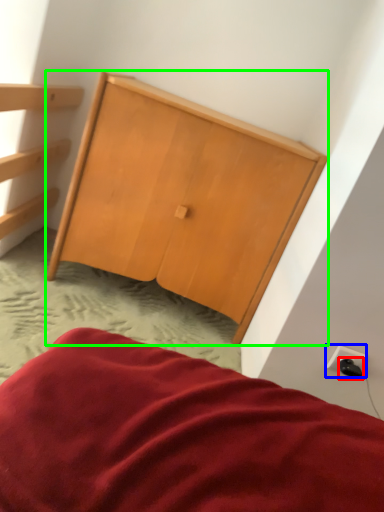
Question: Considering the real-world distances, which object is closest to plug (highlighted by a red box)? electric outlet (highlighted by a blue box) or furniture (highlighted by a green box).

Choices:
 (A) electric outlet
 (B) furniture

Answer: (A)